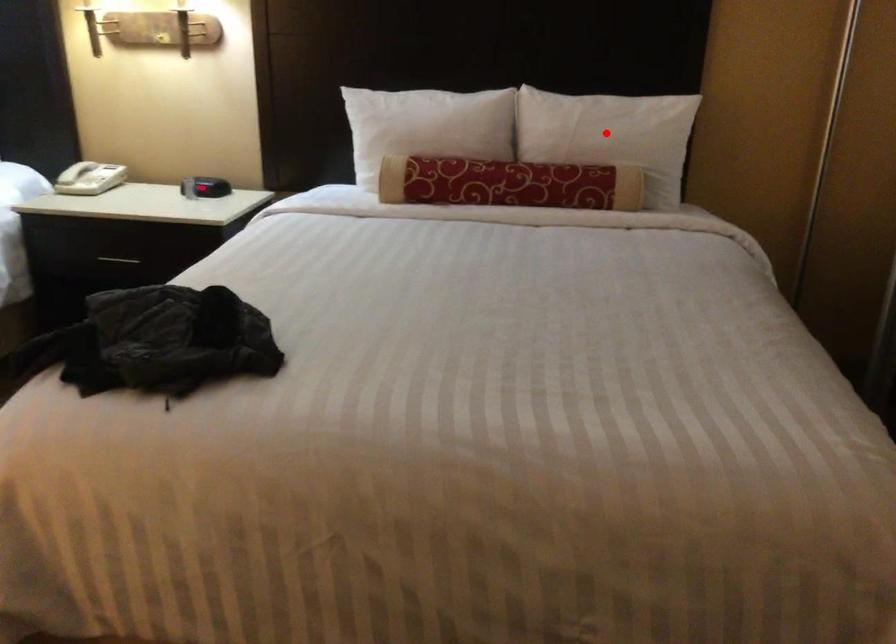
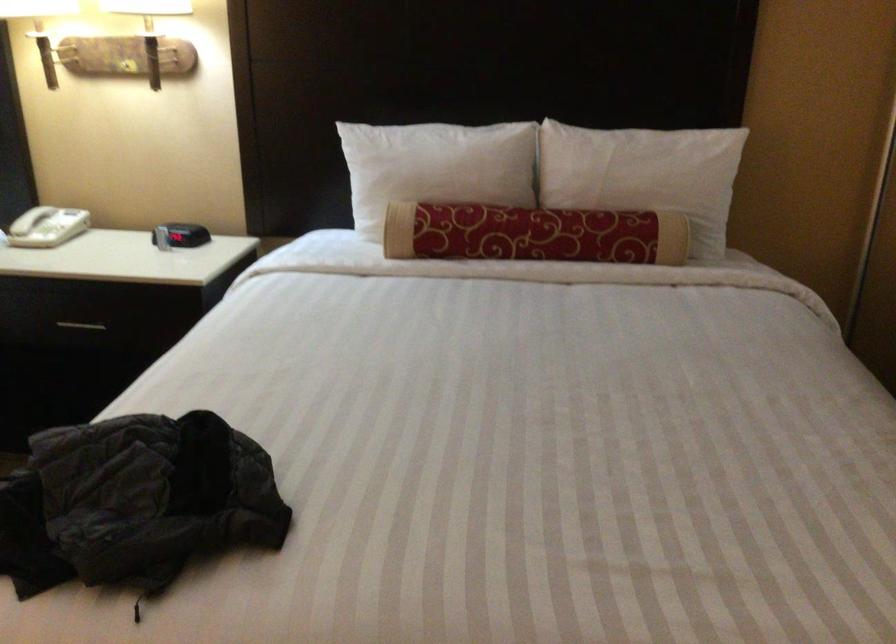
The point at the highlighted location is marked in the first image. Where is the corresponding point in the second image?

(643, 174)